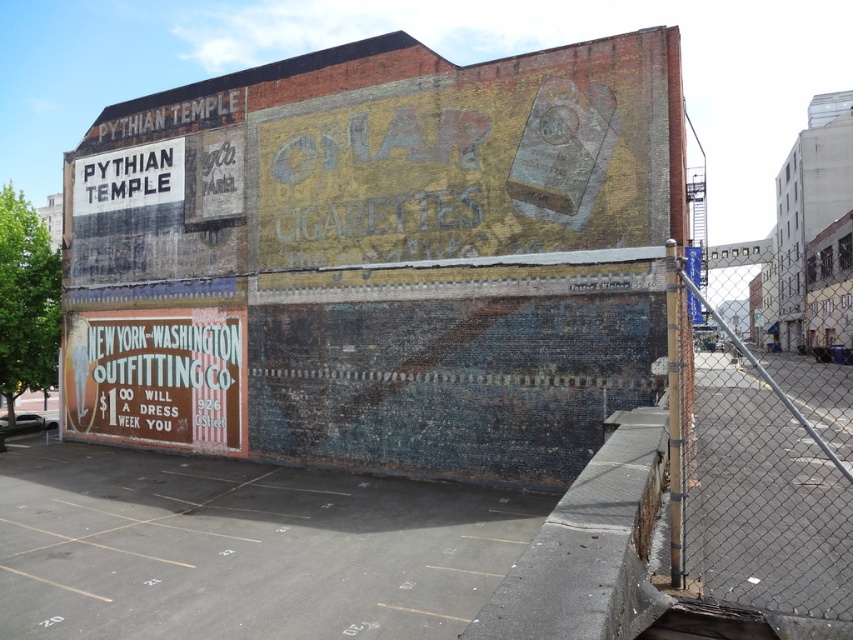
Is weathered brick wall at center bigger than rusty chain-link fence at right?

Actually, weathered brick wall at center might be smaller than rusty chain-link fence at right.

Does point (625, 209) lie behind point (689, 355)?

Yes.

Is point (73, 272) closer to camera compared to point (746, 452)?

No.

This screenshot has height=640, width=853. What are the coordinates of `weathered brick wall at center` in the screenshot? It's located at [379, 257].